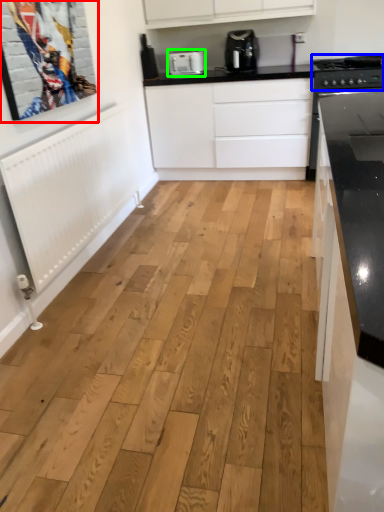
Question: Which is farther away from picture frame (highlighted by a red box)? stove (highlighted by a blue box) or kitchen appliance (highlighted by a green box)?

Choices:
 (A) stove
 (B) kitchen appliance

Answer: (A)